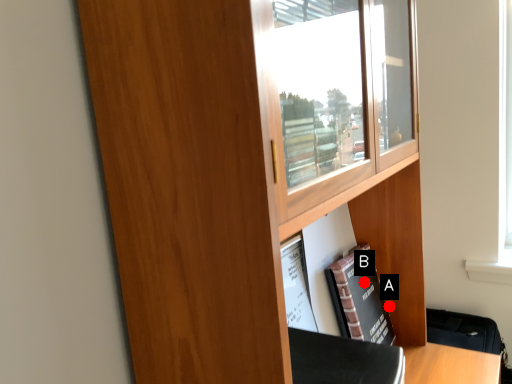
Question: Two points are circled on the image, labeled by A and B beside each circle. Which point appears farthest from the camera in this image?

Choices:
 (A) A is further
 (B) B is further

Answer: (A)